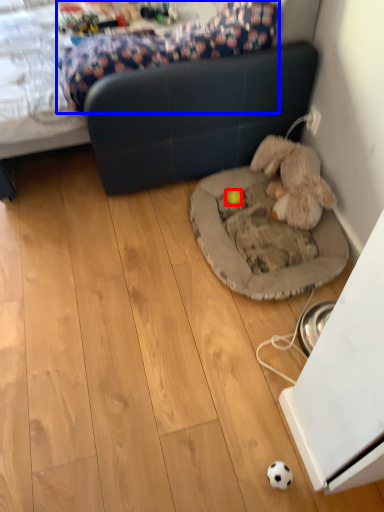
Question: Among these objects, which one is nearest to the camera, toy (highlighted by a red box) or mattress (highlighted by a blue box)?

Choices:
 (A) toy
 (B) mattress

Answer: (B)